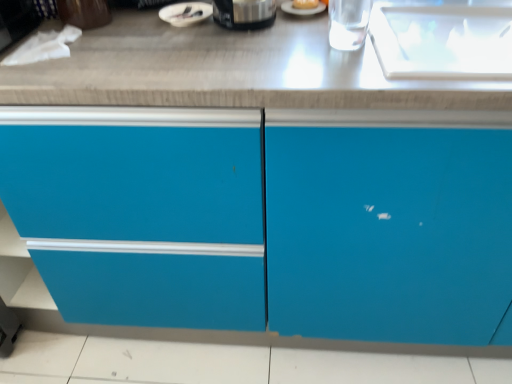
Find the location of a particular element. vacant area that is in front of satin black coffee maker at upper center, the 2th appliance positioned from the left is located at coordinates (240, 56).